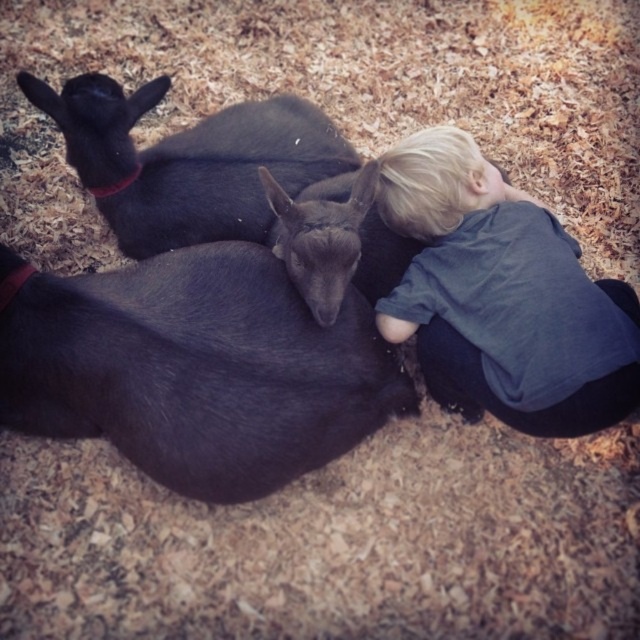
Question: Does shiny black goat at center have a smaller size compared to blonde hair at upper right?

Choices:
 (A) yes
 (B) no

Answer: (B)

Question: Can you confirm if shiny black goat at center is positioned below blonde hair at upper right?

Choices:
 (A) no
 (B) yes

Answer: (B)

Question: Among these objects, which one is nearest to the camera?

Choices:
 (A) blonde hair at upper right
 (B) shiny black goat at center

Answer: (B)

Question: Is the position of shiny black goat at center less distant than that of blonde hair at upper right?

Choices:
 (A) no
 (B) yes

Answer: (B)